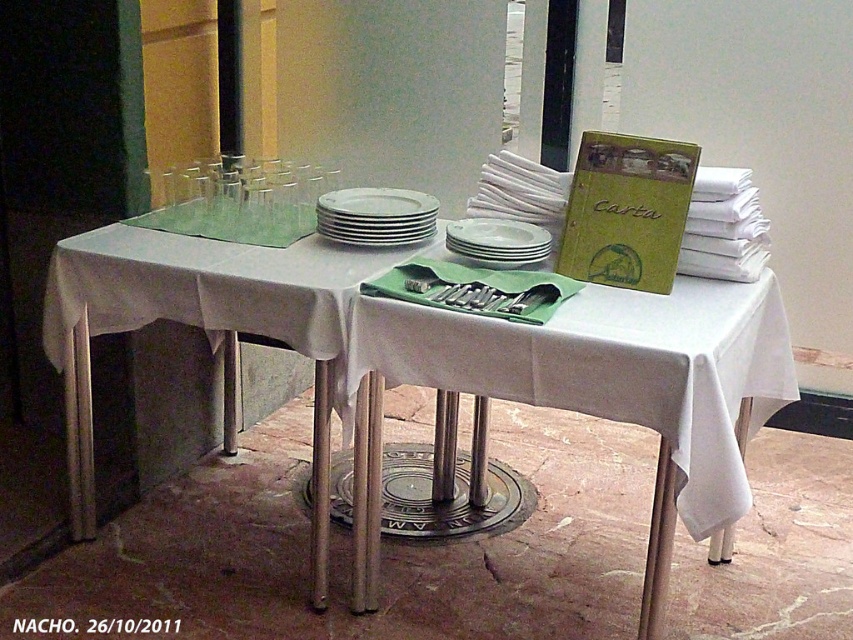
You are standing at the table and want to pick up both items located at point [509,352] and point [386,214]. Which item will you reach first?

You will reach the item at point [509,352] first because it is closer to you than the item at point [386,214].

You are setting up a table for a dinner party and need to place both the white cloth table at center and the white matte plate at center. Given their sizes, which one should you place first to ensure proper arrangement?

Since the white cloth table at center is larger in size than the white matte plate at center, you should place the white cloth table at center first to ensure it has enough space for the plate to be placed on top or beside it appropriately.

You are setting up a table for a dinner party and need to place a decorative vase that requires a surface at least 30 cm in height. The white cloth table at center and the white matte plate at center are available. Which surface can accommodate the vase?

The white cloth table at center is taller than the white matte plate at center, so the vase should be placed on the white cloth table at center to meet the height requirement.